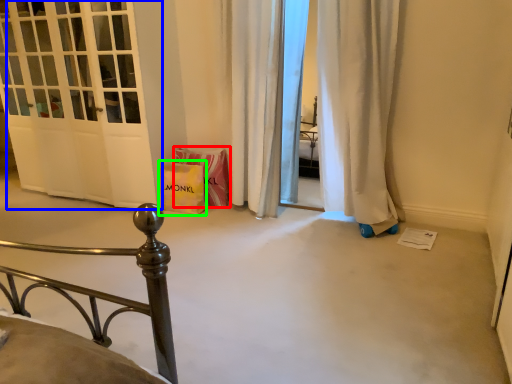
Question: Which object is the farthest from material (highlighted by a red box)? Choose among these: door (highlighted by a blue box) or gift bag (highlighted by a green box).

Choices:
 (A) door
 (B) gift bag

Answer: (A)